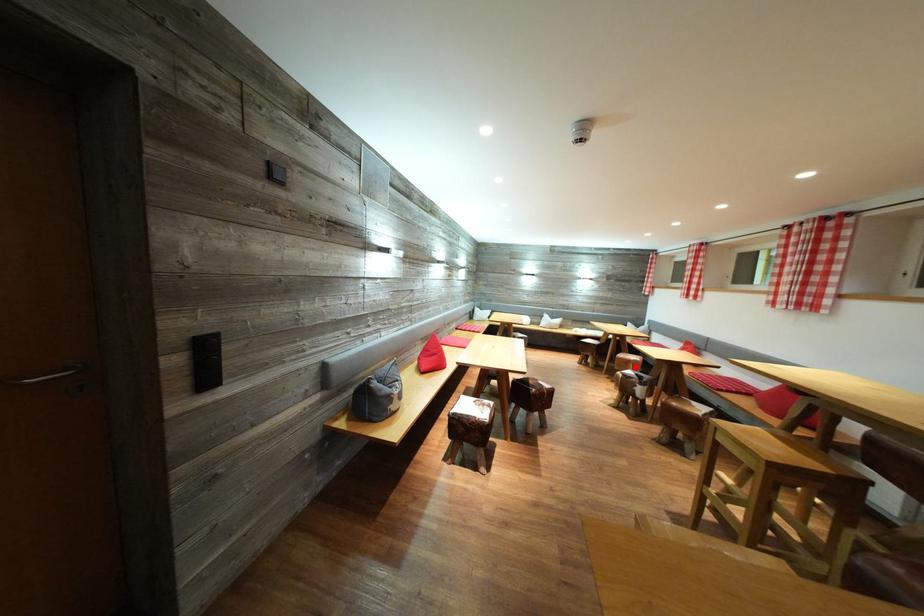
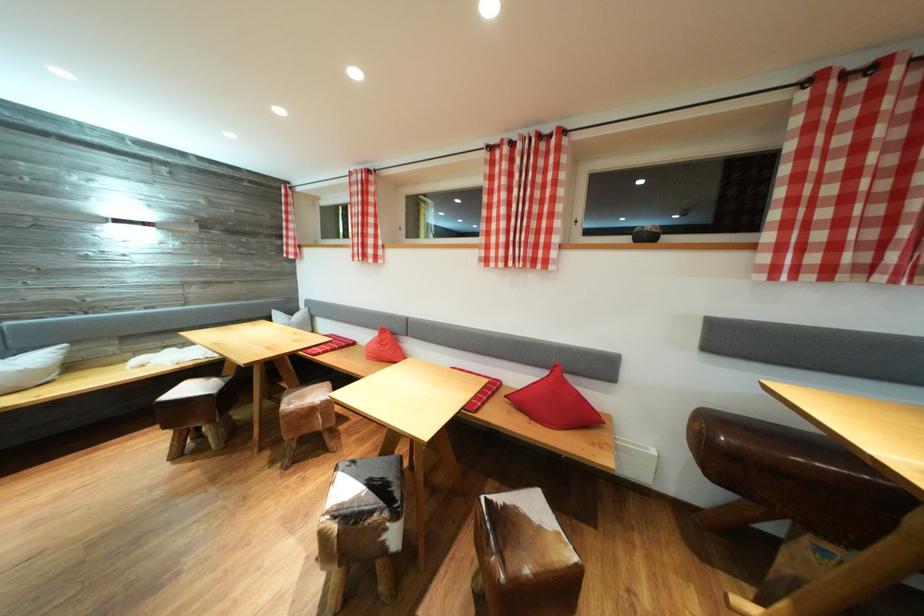
Locate, in the second image, the point that corresponds to the highlighted location in the first image.

(319, 416)